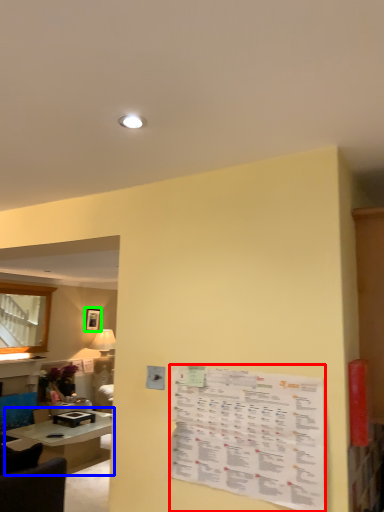
Question: Which object is the farthest from menu (highlighted by a red box)? Choose among these: table (highlighted by a blue box) or picture frame (highlighted by a green box).

Choices:
 (A) table
 (B) picture frame

Answer: (B)